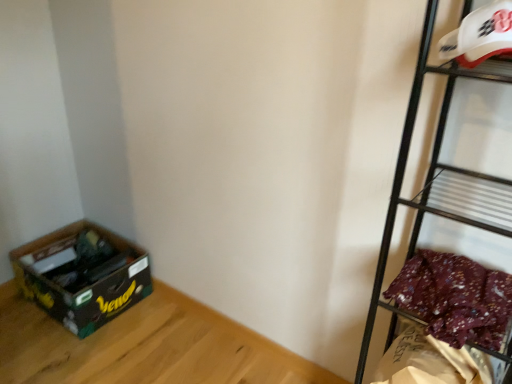
You are a GUI agent. You are given a task and a screenshot of the screen. Output one action in this format:
    pyautogui.click(x=<x>, y=<y>)
    Task: Click on the free point above matte black box at lower left (from a real-world perspective)
    This screenshot has height=384, width=512.
    Given the screenshot: What is the action you would take?
    pyautogui.click(x=109, y=346)